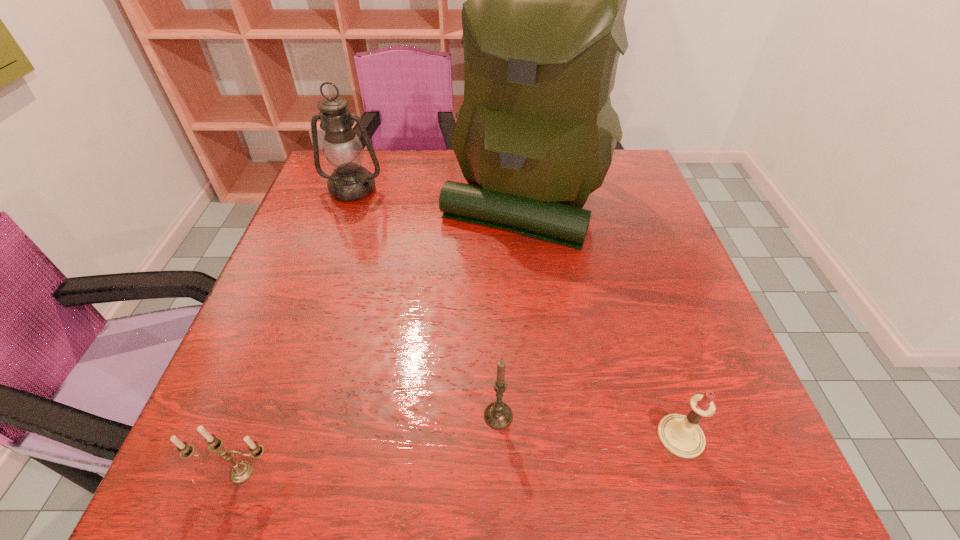
You are a GUI agent. You are given a task and a screenshot of the screen. Output one action in this format:
    pyautogui.click(x=<x>, y=<y>)
    Task: Click on the backpack
    The height and width of the screenshot is (540, 960).
    Given the screenshot: What is the action you would take?
    pyautogui.click(x=543, y=26)

In order to click on oil lamp in this screenshot , I will do `click(343, 150)`.

Locate an element on the screen. The image size is (960, 540). the second candle from right to left is located at coordinates (498, 415).

You are a GUI agent. You are given a task and a screenshot of the screen. Output one action in this format:
    pyautogui.click(x=<x>, y=<y>)
    Task: Click on the nearest object
    This screenshot has width=960, height=540.
    Given the screenshot: What is the action you would take?
    pyautogui.click(x=241, y=471)

Locate an element on the screen. the nearest candle is located at coordinates (241, 471).

I want to click on the rightmost candle, so click(x=681, y=435).

This screenshot has width=960, height=540. Find the location of `free space located on the front of the backpack with visible pockets`. free space located on the front of the backpack with visible pockets is located at coordinates (538, 334).

Locate an element on the screen. This screenshot has width=960, height=540. free location located on the right of the second tallest object is located at coordinates (464, 189).

In order to click on free spot located on the right of the second candle from left to right in this screenshot , I will do `click(700, 415)`.

At what (x,y) coordinates should I click in order to perform the action: click on free region located 0.360m on the back of the nearest object. Please return your answer as a coordinate pair (x, y). This screenshot has width=960, height=540. Looking at the image, I should click on (307, 293).